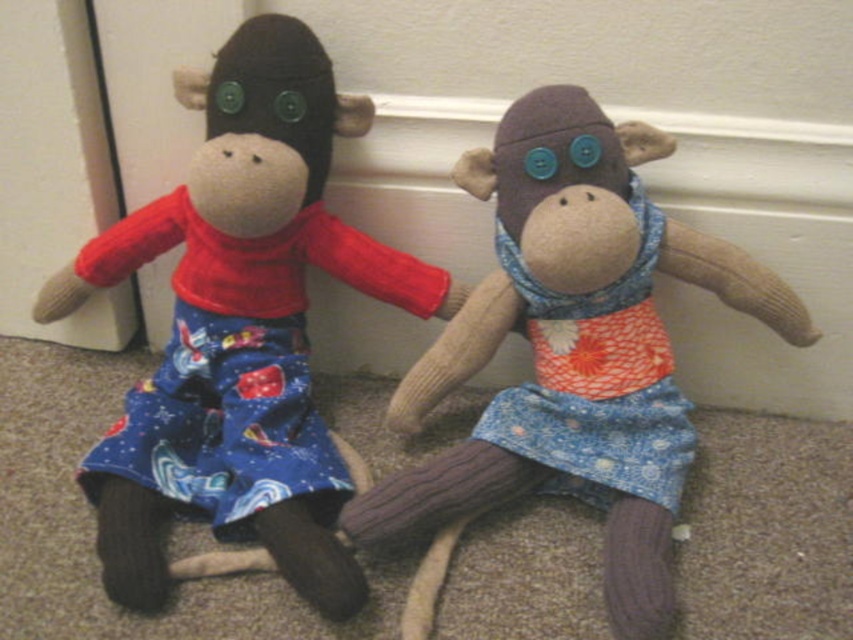
Does matte red sweater at left appear under matte fabric monkey at left?

Incorrect, matte red sweater at left is not positioned below matte fabric monkey at left.

Is matte red sweater at left positioned in front of matte fabric monkey at left?

No.

Does point (103, 561) lie behind point (618, 264)?

That is False.

The height and width of the screenshot is (640, 853). What are the coordinates of `matte red sweater at left` in the screenshot? It's located at (241, 326).